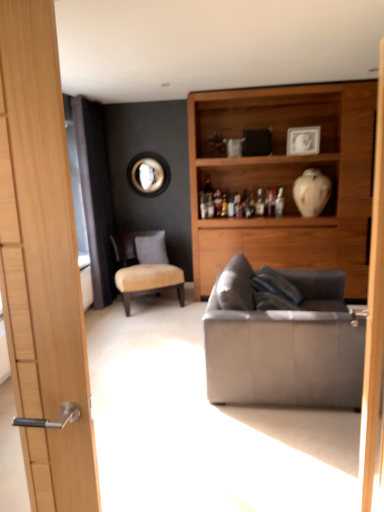
What do you see at coordinates (148, 174) in the screenshot? This screenshot has height=512, width=384. I see `metallic circular mirror at upper center` at bounding box center [148, 174].

Measure the distance between point (x=160, y=183) and camera.

16.39 feet.

Describe the element at coordinates (145, 268) in the screenshot. I see `beige fabric chair at center` at that location.

Locate an element on the screen. white glossy vase at upper right is located at coordinates (311, 192).

What is the approximate width of white glossy vase at upper right?

The width of white glossy vase at upper right is 15.98 inches.

Where is `wooden cabinet at upper right`? wooden cabinet at upper right is located at coordinates (286, 179).

At what (x,y) coordinates should I click in order to perform the action: click on suede gray couch at right. Please return your answer as a coordinate pair (x, y). The width and height of the screenshot is (384, 512). Looking at the image, I should click on (283, 343).

The width and height of the screenshot is (384, 512). What do you see at coordinates (303, 140) in the screenshot?
I see `white glossy picture frame at upper center` at bounding box center [303, 140].

Find the location of `black fabric screen door at left`. black fabric screen door at left is located at coordinates (91, 184).

From the image's perspective, between white glossy picture frame at upper center and wooden cabinet at upper right, who is located below?

wooden cabinet at upper right is shown below in the image.

Which point is more distant from viewer, (295, 140) or (323, 264)?

The point (323, 264) is more distant.

Based on the photo, is white glossy picture frame at upper center oriented towards wooden cabinet at upper right?

Yes, white glossy picture frame at upper center is facing wooden cabinet at upper right.

From the image's perspective, which is below, white glossy picture frame at upper center or metallic circular mirror at upper center?

metallic circular mirror at upper center is shown below in the image.

Is white glossy picture frame at upper center in contact with metallic circular mirror at upper center?

white glossy picture frame at upper center and metallic circular mirror at upper center are not in contact.

Is white glossy picture frame at upper center facing towards metallic circular mirror at upper center?

No, white glossy picture frame at upper center is not turned towards metallic circular mirror at upper center.

Is white fabric pillow at center at the right side of wooden cabinet at upper right?

Incorrect, white fabric pillow at center is not on the right side of wooden cabinet at upper right.

Which object is further away from the camera, white fabric pillow at center or wooden cabinet at upper right?

white fabric pillow at center is further from the camera.

Which is more distant, (165,249) or (207,288)?

The point (165,249) is more distant.

Considering the sizes of metallic circular mirror at upper center and white fabric pillow at center in the image, is metallic circular mirror at upper center bigger or smaller than white fabric pillow at center?

metallic circular mirror at upper center is smaller than white fabric pillow at center.

From the image's perspective, which is above, metallic circular mirror at upper center or white fabric pillow at center?

metallic circular mirror at upper center.

Find the location of a particular element. Image resolution: width=384 pixels, height=512 pixels. mirror that appears above the white fabric pillow at center (from the image's perspective) is located at coordinates (148, 174).

Which is behind, point (148, 195) or point (160, 233)?

The point (148, 195) is more distant.

Looking at this image, can you confirm if wooden cabinet at upper right is positioned to the right of beige fabric chair at center?

Yes, wooden cabinet at upper right is to the right of beige fabric chair at center.

Are wooden cabinet at upper right and beige fabric chair at center far apart?

That's right, there is a large distance between wooden cabinet at upper right and beige fabric chair at center.

Consider the image. Between wooden cabinet at upper right and beige fabric chair at center, which one has more height?

Standing taller between the two is wooden cabinet at upper right.

Does point (230, 127) lie in front of point (169, 285)?

No, (230, 127) is further to viewer.

From the image's perspective, who appears lower, metallic circular mirror at upper center or black fabric screen door at left?

From the image's view, black fabric screen door at left is below.

This screenshot has height=512, width=384. Identify the location of mirror behind the black fabric screen door at left. (148, 174).

Is metallic circular mirror at upper center bigger or smaller than black fabric screen door at left?

In the image, metallic circular mirror at upper center appears to be smaller than black fabric screen door at left.

Are wooden cabinet at upper right and suede gray couch at right making contact?

No, wooden cabinet at upper right is not touching suede gray couch at right.

Does wooden cabinet at upper right turn towards suede gray couch at right?

Yes.

You are a GUI agent. You are given a task and a screenshot of the screen. Output one action in this format:
    pyautogui.click(x=<x>, y=<y>)
    Task: Click on the studio couch below the wooden cabinet at upper right (from a real-world perspective)
    
    Given the screenshot: What is the action you would take?
    (x=283, y=343)

Considering the sizes of objects wooden cabinet at upper right and suede gray couch at right in the image provided, who is bigger, wooden cabinet at upper right or suede gray couch at right?

wooden cabinet at upper right.

Locate an element on the screen. Image resolution: width=384 pixels, height=512 pixels. picture frame behind the wooden cabinet at upper right is located at coordinates (303, 140).

Where is `mirror that is under the white glossy picture frame at upper center (from a real-world perspective)`? mirror that is under the white glossy picture frame at upper center (from a real-world perspective) is located at coordinates (148, 174).

Which object lies nearer to the anchor point black fabric screen door at left, beige fabric chair at center or white glossy vase at upper right?

beige fabric chair at center lies closer to black fabric screen door at left than the other object.

In the scene shown: Considering their positions, is metallic circular mirror at upper center positioned closer to beige fabric chair at center than suede gray couch at right?

Among the two, metallic circular mirror at upper center is located nearer to beige fabric chair at center.

Consider the image. Which object lies further to the anchor point white glossy vase at upper right, white glossy picture frame at upper center or wooden cabinet at upper right?

The object further to white glossy vase at upper right is wooden cabinet at upper right.

Considering their positions, is suede gray couch at right positioned closer to white glossy vase at upper right than white glossy picture frame at upper center?

white glossy picture frame at upper center is positioned closer to the anchor white glossy vase at upper right.

From the image, which object appears to be nearer to suede gray couch at right, white glossy vase at upper right or wooden cabinet at upper right?

wooden cabinet at upper right is positioned closer to the anchor suede gray couch at right.

When comparing their distances from white fabric pillow at center, does black fabric screen door at left or wooden cabinet at upper right seem closer?

black fabric screen door at left is closer to white fabric pillow at center.

In the scene shown: Which object lies further to the anchor point white glossy vase at upper right, wooden cabinet at upper right or black fabric screen door at left?

black fabric screen door at left is further to white glossy vase at upper right.

Based on the photo, estimate the real-world distances between objects in this image. Which object is closer to black fabric screen door at left, suede gray couch at right or white glossy picture frame at upper center?

white glossy picture frame at upper center.

Find the location of `cabinetry between metallic circular mirror at upper center and white glossy vase at upper right in the horizontal direction`. cabinetry between metallic circular mirror at upper center and white glossy vase at upper right in the horizontal direction is located at coordinates (286, 179).

The width and height of the screenshot is (384, 512). I want to click on cabinetry between black fabric screen door at left and white glossy vase at upper right from left to right, so click(x=286, y=179).

This screenshot has width=384, height=512. In order to click on chair between suede gray couch at right and white glossy vase at upper right in the front-back direction in this screenshot , I will do `click(145, 268)`.

This screenshot has height=512, width=384. I want to click on cabinetry located between suede gray couch at right and white glossy picture frame at upper center in the depth direction, so click(x=286, y=179).